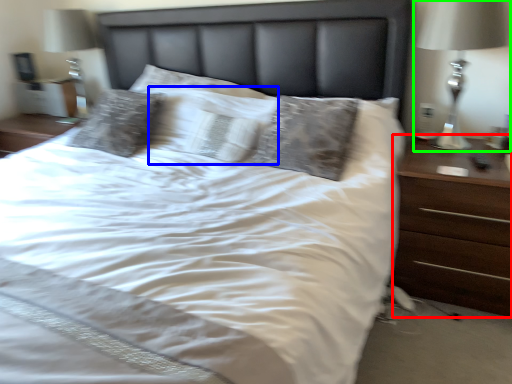
Question: Which is nearer to the nightstand (highlighted by a red box)? pillow (highlighted by a blue box) or bedside lamp (highlighted by a green box).

Choices:
 (A) pillow
 (B) bedside lamp

Answer: (B)